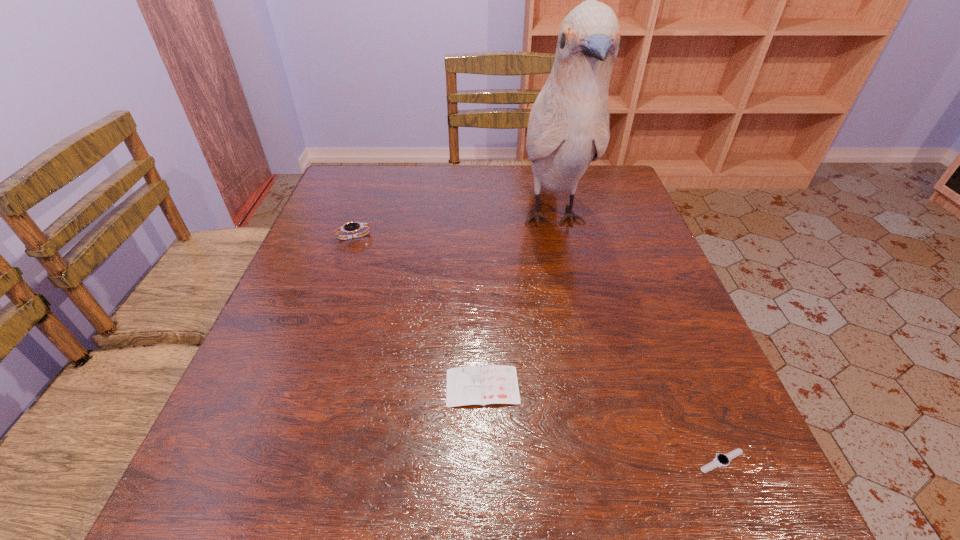
Image resolution: width=960 pixels, height=540 pixels. Find the location of `unoccupied area between the third farthest object and the shortest object`. unoccupied area between the third farthest object and the shortest object is located at coordinates (602, 423).

Where is `free space between the shorter watch and the third object from left to right`? The height and width of the screenshot is (540, 960). free space between the shorter watch and the third object from left to right is located at coordinates (637, 340).

The image size is (960, 540). What are the coordinates of `vacant area between the third farthest object and the second object from right to left` in the screenshot? It's located at (517, 303).

You are a GUI agent. You are given a task and a screenshot of the screen. Output one action in this format:
    pyautogui.click(x=<x>, y=<y>)
    Task: Click on the free space between the parakeet and the right watch
    Image resolution: width=960 pixels, height=540 pixels.
    Given the screenshot: What is the action you would take?
    pyautogui.click(x=637, y=340)

This screenshot has height=540, width=960. Identify the location of free spot between the right watch and the parakeet. (637, 340).

Choose which object is the third nearest neighbor to the parakeet. Please provide its 2D coordinates. Your answer should be formatted as a tuple, i.e. [(x, y)], where the tuple contains the x and y coordinates of a point satisfying the conditions above.

[(721, 460)]

Locate an element on the screen. The width and height of the screenshot is (960, 540). object that ranks as the second closest to the third object from right to left is located at coordinates (721, 460).

Where is `vacant region that satisfies the following two spatial constraints: 1. on the face of the shorter watch; 2. on the right side of the parakeet`? This screenshot has width=960, height=540. vacant region that satisfies the following two spatial constraints: 1. on the face of the shorter watch; 2. on the right side of the parakeet is located at coordinates (605, 461).